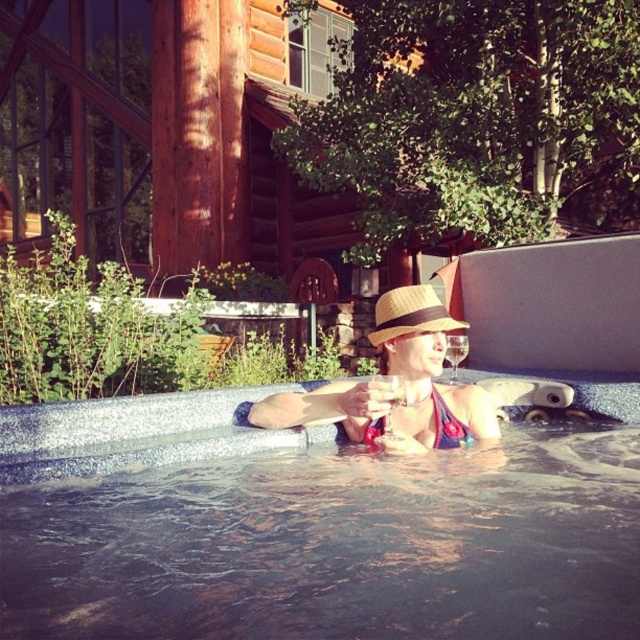
Question: Based on their relative distances, which object is nearer to the straw hat at center?

Choices:
 (A) smooth concrete pool at center
 (B) blue textured bikini top at center
 (C) matte straw hat at center

Answer: (C)

Question: Can you confirm if smooth concrete pool at center is wider than matte straw hat at center?

Choices:
 (A) yes
 (B) no

Answer: (A)

Question: Can you confirm if matte straw hat at center is bigger than straw hat at center?

Choices:
 (A) no
 (B) yes

Answer: (B)

Question: Which object appears farthest from the camera in this image?

Choices:
 (A) straw hat at center
 (B) matte straw hat at center
 (C) blue textured bikini top at center

Answer: (C)

Question: Which object is closer to the camera taking this photo?

Choices:
 (A) smooth concrete pool at center
 (B) blue textured bikini top at center
 (C) straw hat at center

Answer: (A)

Question: Can you confirm if matte straw hat at center is positioned above straw hat at center?

Choices:
 (A) yes
 (B) no

Answer: (B)